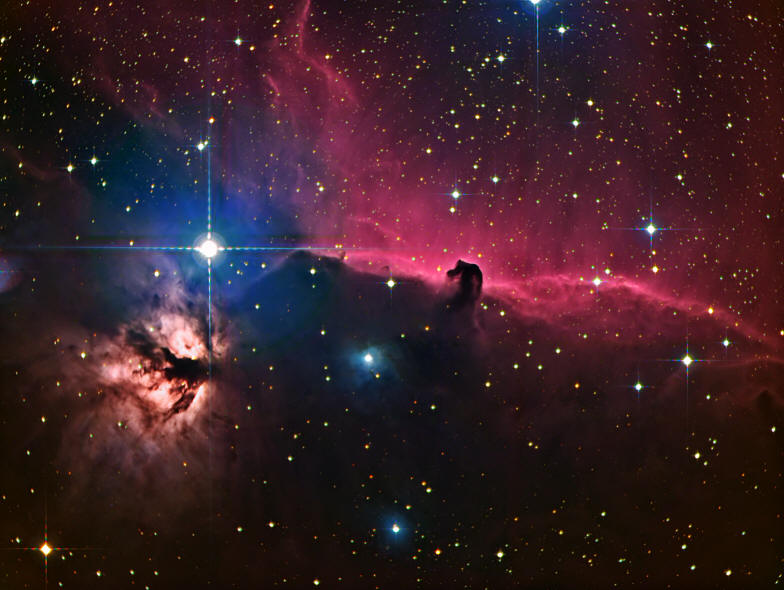
What are the coordinates of `blue lights` in the screenshot? It's located at (374, 355), (398, 525), (643, 231), (543, 0), (466, 193), (633, 395).